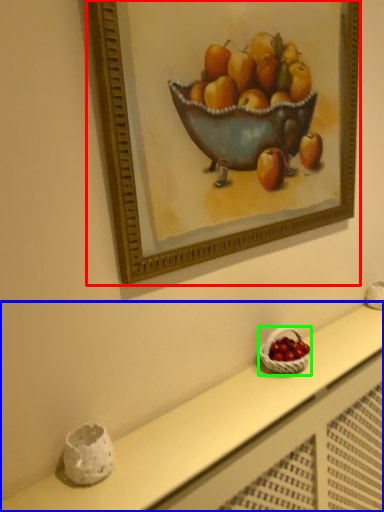
Question: Considering the real-world distances, which object is farthest from picture frame (highlighted by a red box)? table (highlighted by a blue box) or basket (highlighted by a green box)?

Choices:
 (A) table
 (B) basket

Answer: (B)